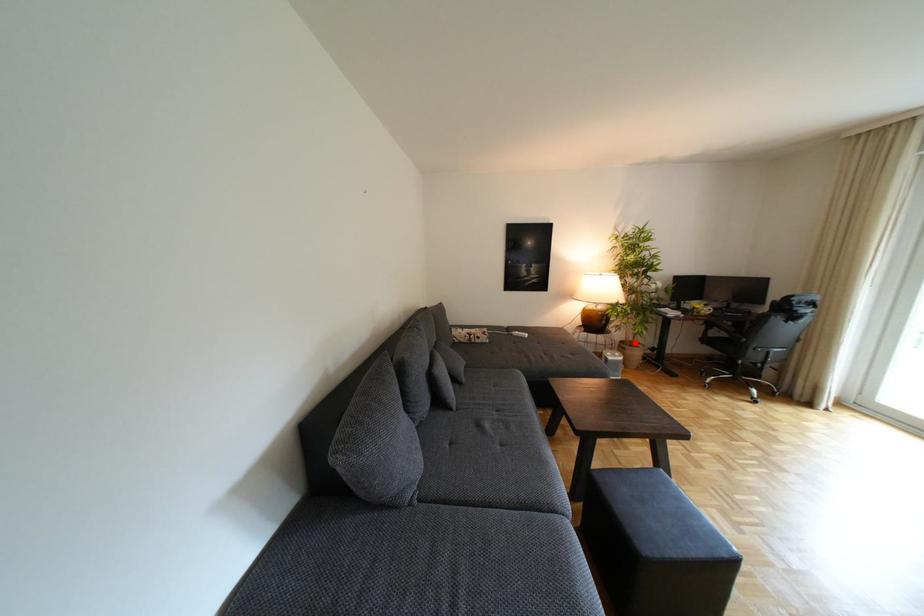
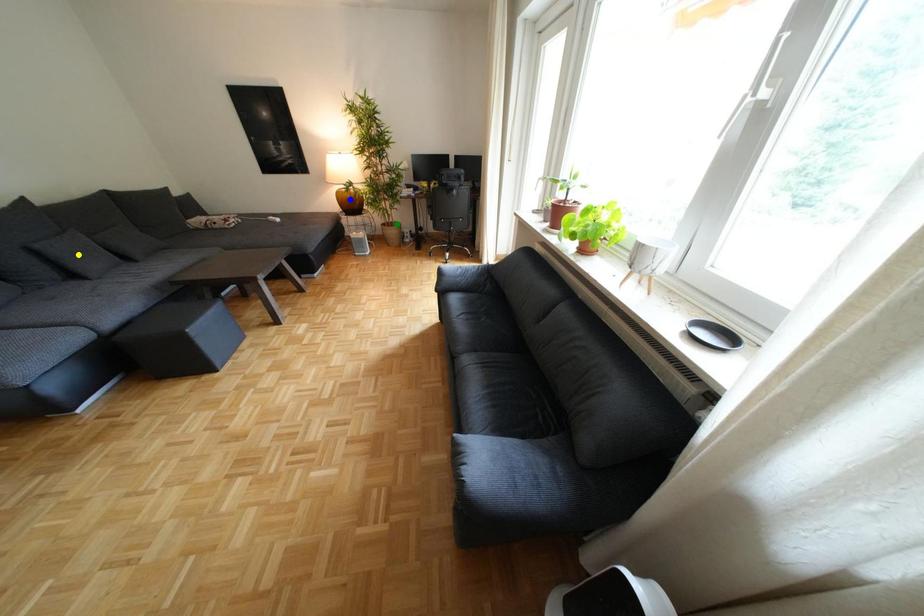
Question: I am providing you with two images of the same scene from different viewpoints. A red point is marked on the first image. You are given multiple points on the second image. Which point in image 2 represents the same 3d spot as the red point in image 1?

Choices:
 (A) blue point
 (B) green point
 (C) yellow point

Answer: (B)